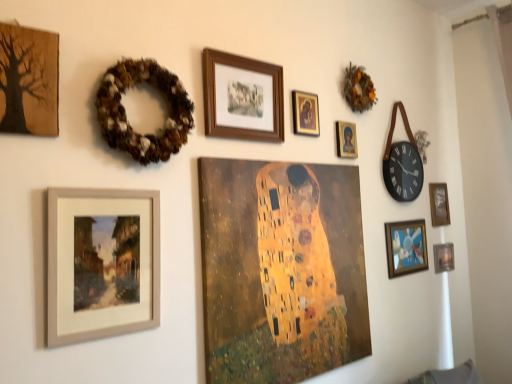
Question: Does wooden textured tree at upper left, acting as the 9th picture frame starting from the right, come behind wooden frame at upper center, the 7th picture frame in the right-to-left sequence?

Choices:
 (A) no
 (B) yes

Answer: (A)

Question: Is wooden textured tree at upper left, acting as the 9th picture frame starting from the right, far from wooden frame at upper center, the 7th picture frame in the right-to-left sequence?

Choices:
 (A) no
 (B) yes

Answer: (A)

Question: From a real-world perspective, is wooden textured tree at upper left, marked as the 1th picture frame in a left-to-right arrangement, located beneath wooden frame at upper center, the 7th picture frame in the right-to-left sequence?

Choices:
 (A) no
 (B) yes

Answer: (B)

Question: From the image's perspective, would you say wooden textured tree at upper left, acting as the 9th picture frame starting from the right, is positioned over wooden frame at upper center, the 7th picture frame in the right-to-left sequence?

Choices:
 (A) no
 (B) yes

Answer: (A)

Question: Is wooden textured tree at upper left, marked as the 1th picture frame in a left-to-right arrangement, at the left side of wooden frame at upper center, placed as the 3th picture frame when sorted from left to right?

Choices:
 (A) yes
 (B) no

Answer: (A)

Question: Is wooden frame at upper center, placed as the 3th picture frame when sorted from left to right, at the back of wooden textured tree at upper left, marked as the 1th picture frame in a left-to-right arrangement?

Choices:
 (A) no
 (B) yes

Answer: (A)

Question: Is brown textured wreath at upper right, which is counted as the second decor, starting from the bottom, outside of metallic silver picture frame at lower right, the 1th picture frame viewed from the right?

Choices:
 (A) yes
 (B) no

Answer: (A)

Question: Is brown textured wreath at upper right, the second decor when ordered from left to right, aimed at metallic silver picture frame at lower right, the 1th picture frame viewed from the right?

Choices:
 (A) no
 (B) yes

Answer: (A)

Question: From the image's perspective, is brown textured wreath at upper right, the second decor when ordered from left to right, on top of metallic silver picture frame at lower right, the 1th picture frame viewed from the right?

Choices:
 (A) no
 (B) yes

Answer: (B)

Question: From the image's perspective, is brown textured wreath at upper right, the 1th decor when ordered from back to front, located beneath metallic silver picture frame at lower right, arranged as the 9th picture frame when viewed from the left?

Choices:
 (A) no
 (B) yes

Answer: (A)

Question: Is brown textured wreath at upper right, the second decor when ordered from left to right, positioned before metallic silver picture frame at lower right, arranged as the 9th picture frame when viewed from the left?

Choices:
 (A) no
 (B) yes

Answer: (B)

Question: Can you confirm if brown textured wreath at upper right, the first decor viewed from the right, is shorter than metallic silver picture frame at lower right, the 1th picture frame viewed from the right?

Choices:
 (A) no
 (B) yes

Answer: (A)

Question: Is matte wooden frame at lower left, placed as the 2th picture frame when sorted from left to right, located outside brown textured wreath at upper left, placed as the first decor when sorted from bottom to top?

Choices:
 (A) yes
 (B) no

Answer: (A)